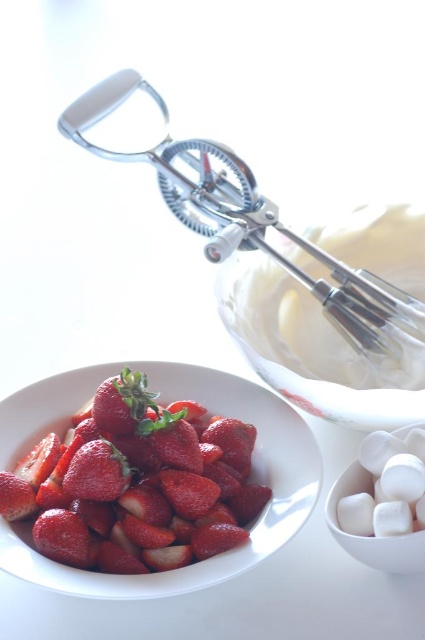
You are arranging ingredients for a dessert and see the glossy red strawberry at center and the red matte strawberry at lower left. Which strawberry is more to the right?

The glossy red strawberry at center is more to the right than the red matte strawberry at lower left.

What is the position of the clear glass bowl at upper center relative to the metallic whisk at upper center in the culinary preparation scene?

The clear glass bowl at upper center is positioned to the right of the metallic whisk at upper center.

Looking at this image, you are a chef preparing a dessert and need to place both the clear glass bowl at upper center and the metallic whisk at upper center on a shelf. The shelf has limited space. Based on the image, which object will require more space on the shelf?

The metallic whisk at upper center will require more space on the shelf because the clear glass bowl at upper center occupies less space than the metallic whisk at upper center.